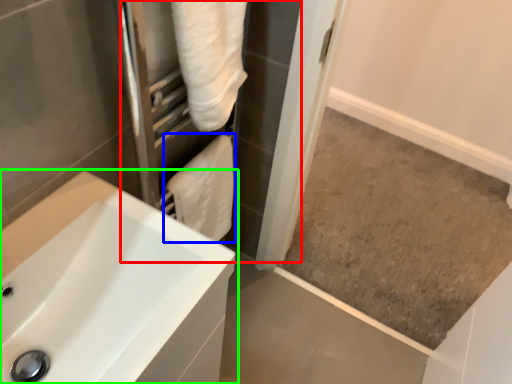
Question: Which object is positioned farthest from screen door (highlighted by a red box)? Select from bath towel (highlighted by a blue box) and sink (highlighted by a green box).

Choices:
 (A) bath towel
 (B) sink

Answer: (B)